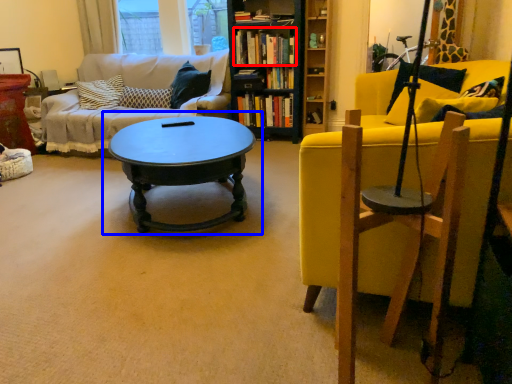
Question: Which point is closer to the camera, book (highlighted by a red box) or coffee table (highlighted by a blue box)?

Choices:
 (A) book
 (B) coffee table

Answer: (B)